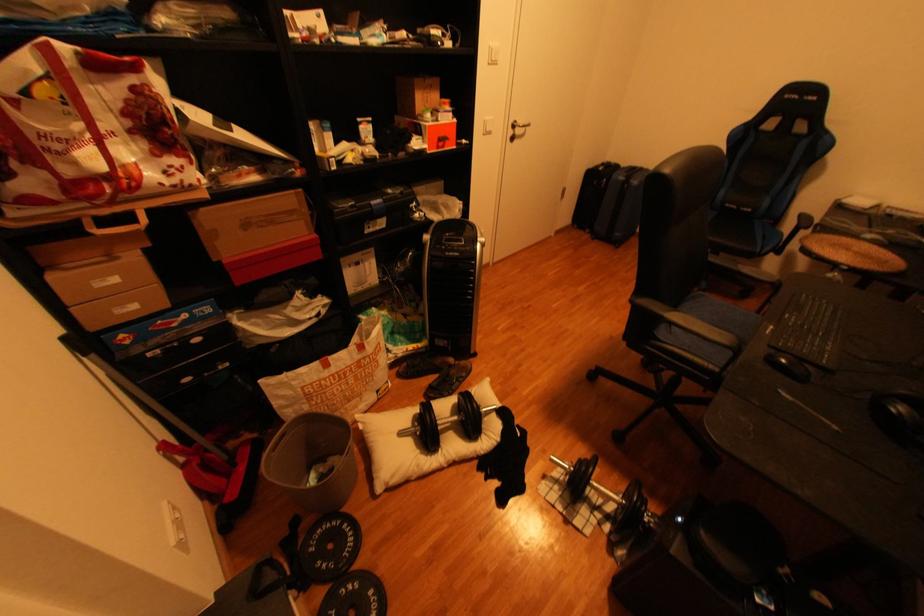
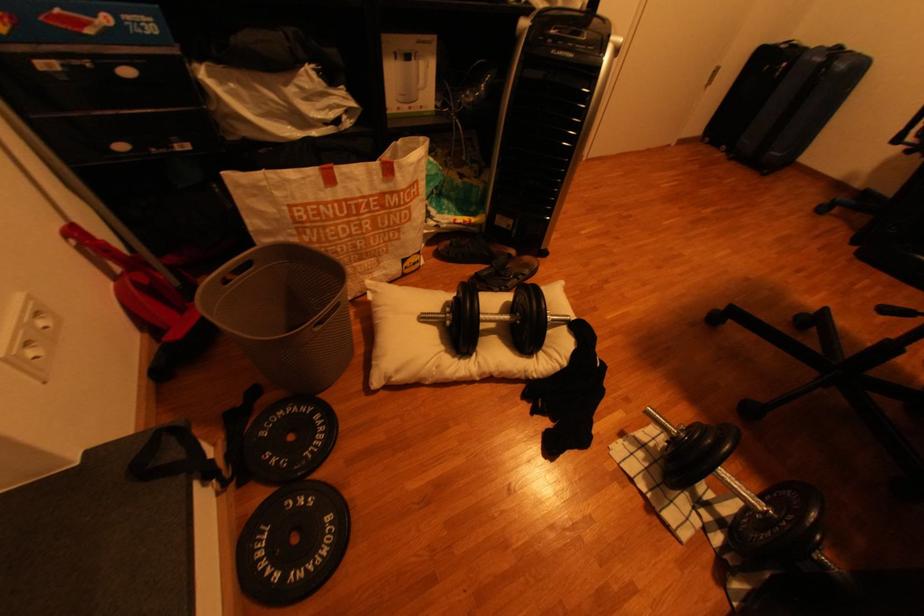
Locate, in the second image, the point that corresponds to point 411,435 in the first image.

(433, 318)